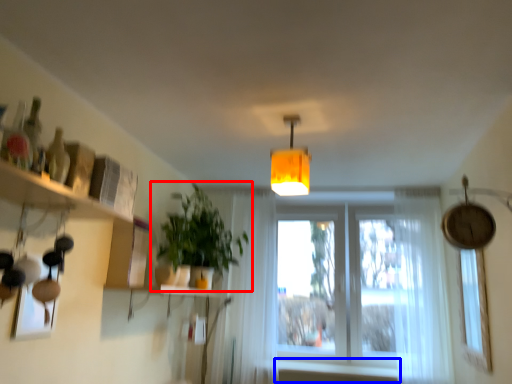
Question: Which object appears farthest to the camera in this image, houseplant (highlighted by a red box) or window sill (highlighted by a blue box)?

Choices:
 (A) houseplant
 (B) window sill

Answer: (B)